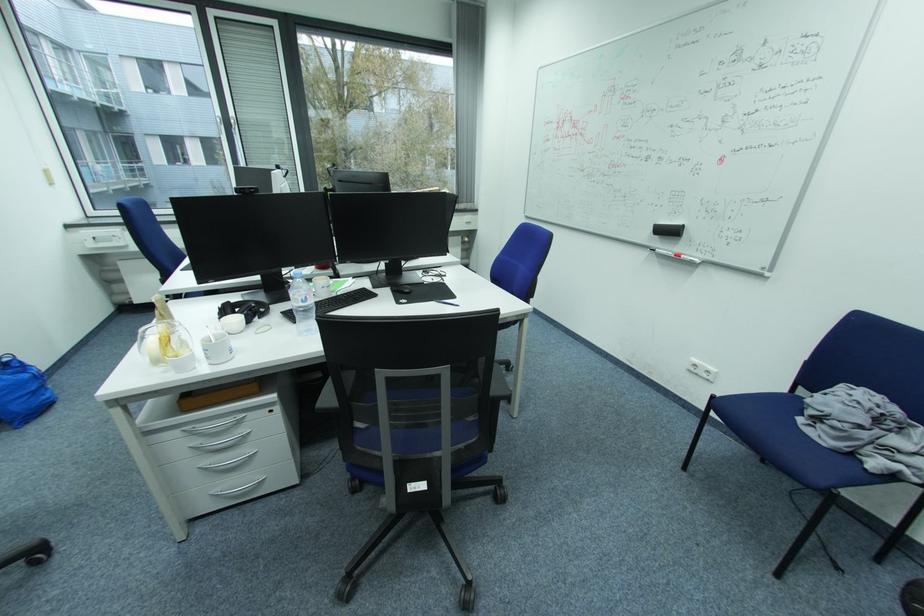
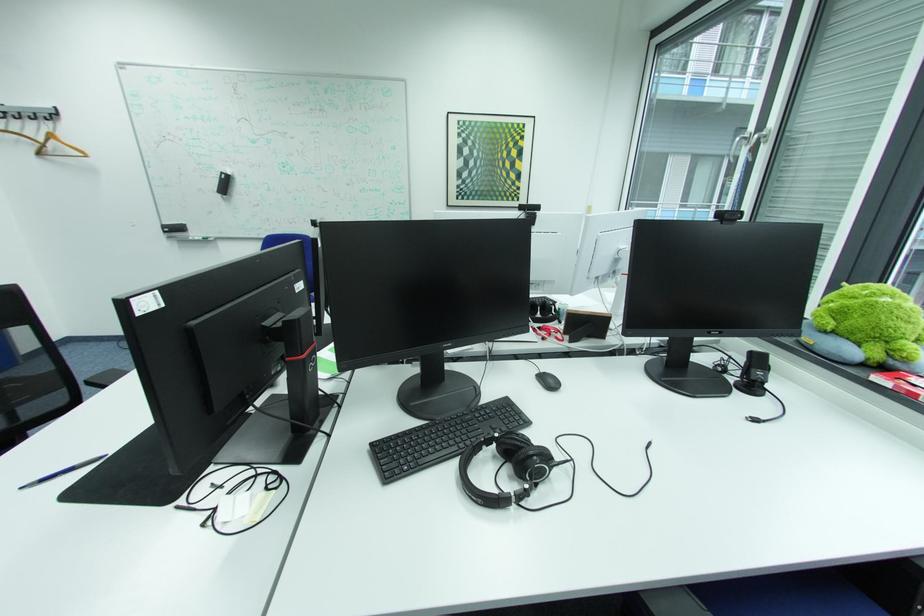
Find the pixel in the second image that matches point 453,281 in the first image.

(187, 508)